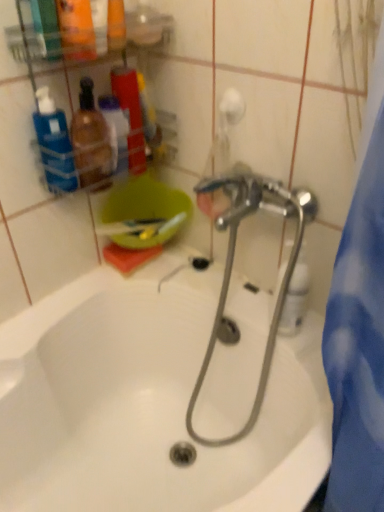
I want to click on blue plastic bottle at upper left, placed as the first cleaning product when sorted from left to right, so click(x=54, y=144).

What do you see at coordinates (130, 114) in the screenshot? Image resolution: width=384 pixels, height=512 pixels. I see `translucent plastic bottles at upper left, which is counted as the 1th toiletry, starting from the right` at bounding box center [130, 114].

Where is `clear plastic spray bottle at center, marked as the 2th cleaning product in a top-to-bottom arrangement`? The image size is (384, 512). clear plastic spray bottle at center, marked as the 2th cleaning product in a top-to-bottom arrangement is located at coordinates (295, 297).

Are clear plastic spray bottle at center, the first cleaning product ordered from the bottom, and white glossy bathtub at center making contact?

clear plastic spray bottle at center, the first cleaning product ordered from the bottom, and white glossy bathtub at center are not in contact.

Looking at their sizes, would you say clear plastic spray bottle at center, the first cleaning product ordered from the bottom, is wider or thinner than white glossy bathtub at center?

Considering their sizes, clear plastic spray bottle at center, the first cleaning product ordered from the bottom, looks slimmer than white glossy bathtub at center.

Measure the distance from clear plastic spray bottle at center, marked as the 2th cleaning product in a top-to-bottom arrangement, to white glossy bathtub at center.

clear plastic spray bottle at center, marked as the 2th cleaning product in a top-to-bottom arrangement, is 14.60 inches away from white glossy bathtub at center.

In terms of height, does translucent plastic bottles at left, the 2th toiletry from the right, look taller or shorter compared to clear plastic spray bottle at center, marked as the 2th cleaning product in a top-to-bottom arrangement?

translucent plastic bottles at left, the 2th toiletry from the right, is shorter than clear plastic spray bottle at center, marked as the 2th cleaning product in a top-to-bottom arrangement.

Is translucent plastic bottles at left, arranged as the 1th toiletry when viewed from the left, facing away from clear plastic spray bottle at center, marked as the 2th cleaning product in a top-to-bottom arrangement?

No, translucent plastic bottles at left, arranged as the 1th toiletry when viewed from the left,'s orientation is not away from clear plastic spray bottle at center, marked as the 2th cleaning product in a top-to-bottom arrangement.

What's the angular difference between translucent plastic bottles at left, the 2th toiletry from the right, and clear plastic spray bottle at center, which is the second cleaning product in left-to-right order,'s facing directions?

90 degrees separate the facing orientations of translucent plastic bottles at left, the 2th toiletry from the right, and clear plastic spray bottle at center, which is the second cleaning product in left-to-right order.

The image size is (384, 512). I want to click on the 2nd toiletry to the left when counting from the clear plastic spray bottle at center, placed as the 1th cleaning product when sorted from right to left, so click(x=91, y=141).

Between clear plastic spray bottle at center, the first cleaning product ordered from the bottom, and translucent plastic bottles at left, the 2th toiletry from the right, which one has more height?

clear plastic spray bottle at center, the first cleaning product ordered from the bottom.

Between point (289, 286) and point (77, 139), which one is positioned behind?

The point (77, 139) is farther from the camera.

Which is more to the right, clear plastic spray bottle at center, the first cleaning product ordered from the bottom, or translucent plastic bottles at left, the 2th toiletry from the right?

clear plastic spray bottle at center, the first cleaning product ordered from the bottom.

Considering the relative positions of white glossy bathtub at center and clear plastic spray bottle at center, the first cleaning product ordered from the bottom, in the image provided, is white glossy bathtub at center behind clear plastic spray bottle at center, the first cleaning product ordered from the bottom,?

No, the depth of white glossy bathtub at center is less than that of clear plastic spray bottle at center, the first cleaning product ordered from the bottom.

Do you think white glossy bathtub at center is within clear plastic spray bottle at center, placed as the 1th cleaning product when sorted from right to left, or outside of it?

white glossy bathtub at center is located beyond the bounds of clear plastic spray bottle at center, placed as the 1th cleaning product when sorted from right to left.

Between point (87, 455) and point (287, 301), which one is positioned in front?

Positioned in front is point (287, 301).

Does white glossy bathtub at center have a lesser height compared to clear plastic spray bottle at center, the first cleaning product ordered from the bottom?

In fact, white glossy bathtub at center may be taller than clear plastic spray bottle at center, the first cleaning product ordered from the bottom.

Is translucent plastic bottles at upper left, which is the second toiletry from left to right, located outside blue plastic bottle at upper left, placed as the first cleaning product when sorted from left to right?

That's correct, translucent plastic bottles at upper left, which is the second toiletry from left to right, is outside of blue plastic bottle at upper left, placed as the first cleaning product when sorted from left to right.

Relative to blue plastic bottle at upper left, placed as the first cleaning product when sorted from left to right, is translucent plastic bottles at upper left, which is the second toiletry from left to right, in front or behind?

In the image, translucent plastic bottles at upper left, which is the second toiletry from left to right, appears behind blue plastic bottle at upper left, placed as the first cleaning product when sorted from left to right.

Does translucent plastic bottles at upper left, which is counted as the 1th toiletry, starting from the right, have a greater height compared to blue plastic bottle at upper left, placed as the first cleaning product when sorted from left to right?

Yes, translucent plastic bottles at upper left, which is counted as the 1th toiletry, starting from the right, is taller than blue plastic bottle at upper left, placed as the first cleaning product when sorted from left to right.

Is point (134, 126) positioned after point (40, 91)?

Yes.

From the image's perspective, would you say blue plastic bottle at upper left, the 1th cleaning product in the top-to-bottom sequence, is shown under white glossy bathtub at center?

No, from the image's perspective, blue plastic bottle at upper left, the 1th cleaning product in the top-to-bottom sequence, is not below white glossy bathtub at center.

From a real-world perspective, who is located lower, blue plastic bottle at upper left, the 1th cleaning product in the top-to-bottom sequence, or white glossy bathtub at center?

white glossy bathtub at center, from a real-world perspective.

Does blue plastic bottle at upper left, the 1th cleaning product in the top-to-bottom sequence, have a smaller size compared to white glossy bathtub at center?

Yes.

Which of these two, blue plastic bottle at upper left, the 2th cleaning product when ordered from right to left, or white glossy bathtub at center, is wider?

white glossy bathtub at center.

The width and height of the screenshot is (384, 512). Identify the location of cleaning product below the blue plastic bottle at upper left, the 1th cleaning product in the top-to-bottom sequence (from a real-world perspective). (295, 297).

Which is in front, point (297, 302) or point (46, 177)?

The point (297, 302) is more forward.

From the image's perspective, which object appears higher, clear plastic spray bottle at center, the first cleaning product ordered from the bottom, or blue plastic bottle at upper left, which ranks as the 2th cleaning product in bottom-to-top order?

blue plastic bottle at upper left, which ranks as the 2th cleaning product in bottom-to-top order.

From a real-world perspective, is clear plastic spray bottle at center, placed as the 1th cleaning product when sorted from right to left, under blue plastic bottle at upper left, the 1th cleaning product in the top-to-bottom sequence?

Indeed, from a real-world perspective, clear plastic spray bottle at center, placed as the 1th cleaning product when sorted from right to left, is positioned beneath blue plastic bottle at upper left, the 1th cleaning product in the top-to-bottom sequence.

Identify the location of bathtub that appears below the clear plastic spray bottle at center, the first cleaning product ordered from the bottom (from a real-world perspective). (155, 401).

Find the location of a particular element. The height and width of the screenshot is (512, 384). the 1st toiletry above the clear plastic spray bottle at center, the first cleaning product ordered from the bottom (from the image's perspective) is located at coordinates (91, 141).

When comparing their distances from translucent plastic bottles at upper left, which is counted as the 1th toiletry, starting from the right, does clear plastic spray bottle at center, marked as the 2th cleaning product in a top-to-bottom arrangement, or white glossy bathtub at center seem further?

Based on the image, white glossy bathtub at center appears to be further to translucent plastic bottles at upper left, which is counted as the 1th toiletry, starting from the right.

When comparing their distances from clear plastic spray bottle at center, marked as the 2th cleaning product in a top-to-bottom arrangement, does blue plastic bottle at upper left, which ranks as the 2th cleaning product in bottom-to-top order, or translucent plastic bottles at upper left, which is counted as the 1th toiletry, starting from the right, seem closer?

translucent plastic bottles at upper left, which is counted as the 1th toiletry, starting from the right, is positioned closer to the anchor clear plastic spray bottle at center, marked as the 2th cleaning product in a top-to-bottom arrangement.

Looking at the image, which one is located closer to white glossy bathtub at center, translucent plastic bottles at left, the 2th toiletry from the right, or clear plastic spray bottle at center, the first cleaning product ordered from the bottom?

clear plastic spray bottle at center, the first cleaning product ordered from the bottom, lies closer to white glossy bathtub at center than the other object.

Considering their positions, is translucent plastic bottles at upper left, which is counted as the 1th toiletry, starting from the right, positioned further to blue plastic bottle at upper left, placed as the first cleaning product when sorted from left to right, than clear plastic spray bottle at center, the first cleaning product ordered from the bottom?

Among the two, clear plastic spray bottle at center, the first cleaning product ordered from the bottom, is located further to blue plastic bottle at upper left, placed as the first cleaning product when sorted from left to right.

From the image, which object appears to be farther from translucent plastic bottles at upper left, which is the second toiletry from left to right, translucent plastic bottles at left, the 2th toiletry from the right, or clear plastic spray bottle at center, marked as the 2th cleaning product in a top-to-bottom arrangement?

clear plastic spray bottle at center, marked as the 2th cleaning product in a top-to-bottom arrangement, is positioned further to the anchor translucent plastic bottles at upper left, which is the second toiletry from left to right.

When comparing their distances from blue plastic bottle at upper left, the 1th cleaning product in the top-to-bottom sequence, does translucent plastic bottles at left, the 2th toiletry from the right, or white glossy bathtub at center seem closer?

Based on the image, translucent plastic bottles at left, the 2th toiletry from the right, appears to be nearer to blue plastic bottle at upper left, the 1th cleaning product in the top-to-bottom sequence.

Based on their spatial positions, is clear plastic spray bottle at center, marked as the 2th cleaning product in a top-to-bottom arrangement, or white glossy bathtub at center further from translucent plastic bottles at left, the 2th toiletry from the right?

Among the two, white glossy bathtub at center is located further to translucent plastic bottles at left, the 2th toiletry from the right.

Based on the photo, from the image, which object appears to be farther from blue plastic bottle at upper left, which ranks as the 2th cleaning product in bottom-to-top order, white glossy bathtub at center or translucent plastic bottles at left, the 2th toiletry from the right?

Based on the image, white glossy bathtub at center appears to be further to blue plastic bottle at upper left, which ranks as the 2th cleaning product in bottom-to-top order.

Image resolution: width=384 pixels, height=512 pixels. Identify the location of toiletry between translucent plastic bottles at upper left, which is the second toiletry from left to right, and white glossy bathtub at center, in the vertical direction. (91, 141).

Locate an element on the screen. This screenshot has height=512, width=384. toiletry located between translucent plastic bottles at left, arranged as the 1th toiletry when viewed from the left, and clear plastic spray bottle at center, placed as the 1th cleaning product when sorted from right to left, in the left-right direction is located at coordinates (130, 114).

You are a GUI agent. You are given a task and a screenshot of the screen. Output one action in this format:
    pyautogui.click(x=<x>, y=<y>)
    Task: Click on the bathtub situated between blue plastic bottle at upper left, placed as the first cleaning product when sorted from left to right, and clear plastic spray bottle at center, which is the second cleaning product in left-to-right order, from left to right
    This screenshot has width=384, height=512.
    Given the screenshot: What is the action you would take?
    pyautogui.click(x=155, y=401)

This screenshot has width=384, height=512. What are the coordinates of `toiletry between blue plastic bottle at upper left, placed as the first cleaning product when sorted from left to right, and translucent plastic bottles at upper left, which is the second toiletry from left to right, from left to right` in the screenshot? It's located at (91, 141).